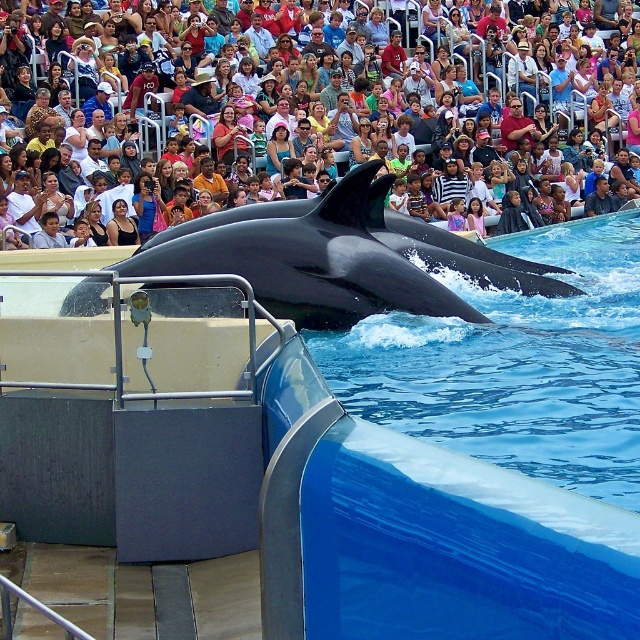
Question: Can you confirm if black smooth whale at center is wider than matte black dolphin at center?

Choices:
 (A) yes
 (B) no

Answer: (B)

Question: Among these points, which one is farthest from the camera?

Choices:
 (A) (484, 65)
 (B) (388, 276)

Answer: (A)

Question: Can you confirm if black smooth whale at center is positioned below matte black dolphin at center?

Choices:
 (A) yes
 (B) no

Answer: (A)

Question: Can you confirm if black smooth whale at center is positioned to the right of matte black dolphin at center?

Choices:
 (A) no
 (B) yes

Answer: (A)